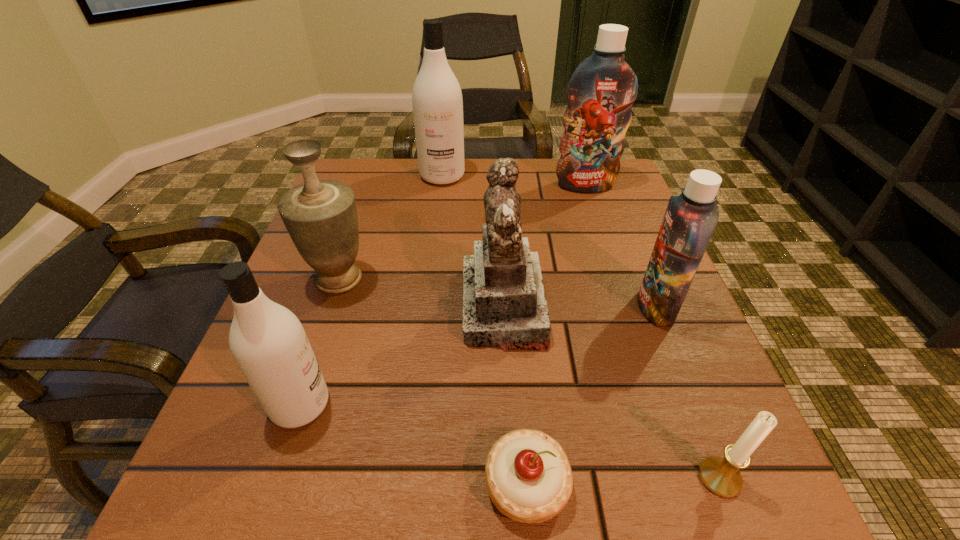
At what (x,y) coordinates should I click in order to perform the action: click on free space between the bigger blue shampoo and the second nearest shampoo. Please return your answer as a coordinate pair (x, y). The width and height of the screenshot is (960, 540). Looking at the image, I should click on (620, 246).

This screenshot has width=960, height=540. Identify the location of free space between the nearer blue shampoo and the figurine. (580, 307).

At what (x,y) coordinates should I click in order to perform the action: click on vacant space that is in between the figurine and the bigger white shampoo. Please return your answer as a coordinate pair (x, y). This screenshot has width=960, height=540. Looking at the image, I should click on (473, 241).

This screenshot has width=960, height=540. Identify the location of object that ranks as the sixth closest to the nearer blue shampoo. (320, 216).

Choose which object is the nearest neighbor to the nearest shampoo. Please provide its 2D coordinates. Your answer should be formatted as a tuple, i.e. [(x, y)], where the tuple contains the x and y coordinates of a point satisfying the conditions above.

[(320, 216)]

Locate an element on the screen. Image resolution: width=960 pixels, height=540 pixels. the fourth closest shampoo to the figurine is located at coordinates (437, 102).

This screenshot has height=540, width=960. I want to click on the second closest shampoo to the third farthest shampoo, so click(437, 102).

The width and height of the screenshot is (960, 540). In order to click on free spot that satisfies the following two spatial constraints: 1. on the front-facing side of the right white shampoo; 2. on the front-facing side of the smaller white shampoo in this screenshot , I will do `click(415, 404)`.

Locate an element on the screen. vacant space that satisfies the following two spatial constraints: 1. on the front-facing side of the farther white shampoo; 2. on the left side of the pastry is located at coordinates (405, 484).

Identify the location of vacant space that satisfies the following two spatial constraints: 1. on the front label of the bigger blue shampoo; 2. on the front-facing side of the left white shampoo. The image size is (960, 540). (658, 404).